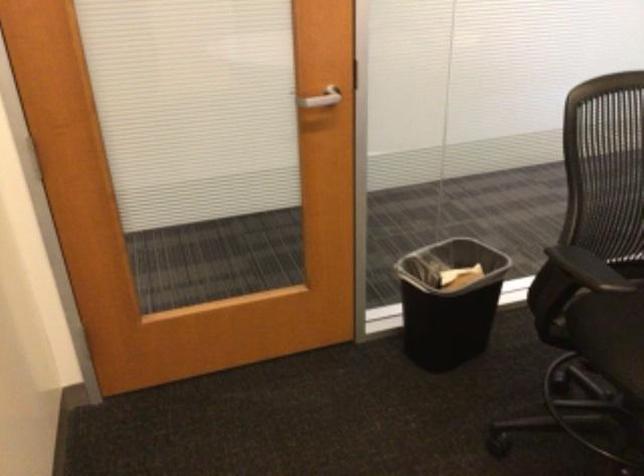
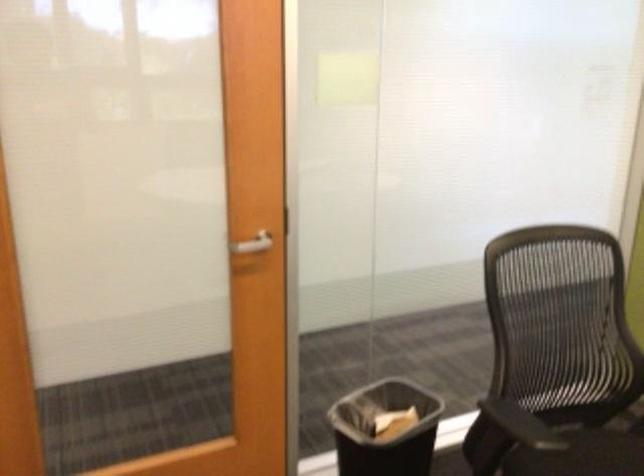
Question: The images are taken continuously from a first-person perspective. In which direction is your viewpoint rotating?

Choices:
 (A) Left
 (B) Right
 (C) Up
 (D) Down

Answer: (C)